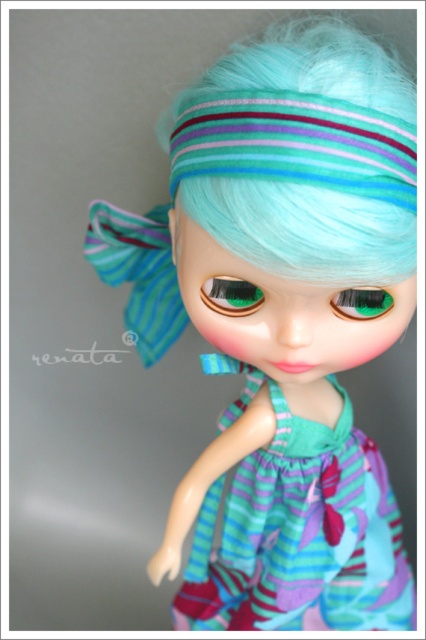
You are a tailor measuring fabrics for a doll. You have two items to compare in the image. Which object has a greater width between the teal striped fabric dress at center and the striped fabric headband at upper center?

The teal striped fabric dress at center has a greater width than the striped fabric headband at upper center.

You are a fashion designer observing the doll. You need to determine the placement of the teal striped fabric dress at center and the striped fabric headband at upper center. Which item is positioned lower on the doll?

The teal striped fabric dress at center is positioned lower than the striped fabric headband at upper center.

You are a fashion designer trying to create a matching accessory for the teal striped fabric dress at center and the striped fabric headband at upper center. Which item would you need to make smaller to ensure the accessory matches in scale?

The teal striped fabric dress at center occupies less space than the striped fabric headband at upper center, so to ensure the accessory matches in scale, you would need to make the accessory smaller to match the size of the teal striped fabric dress at center.